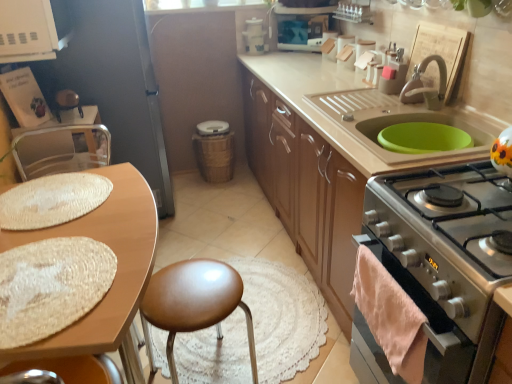
Locate an element on the screen. Image resolution: width=512 pixels, height=384 pixels. free space above wooden table at left (from a real-world perspective) is located at coordinates [x=65, y=248].